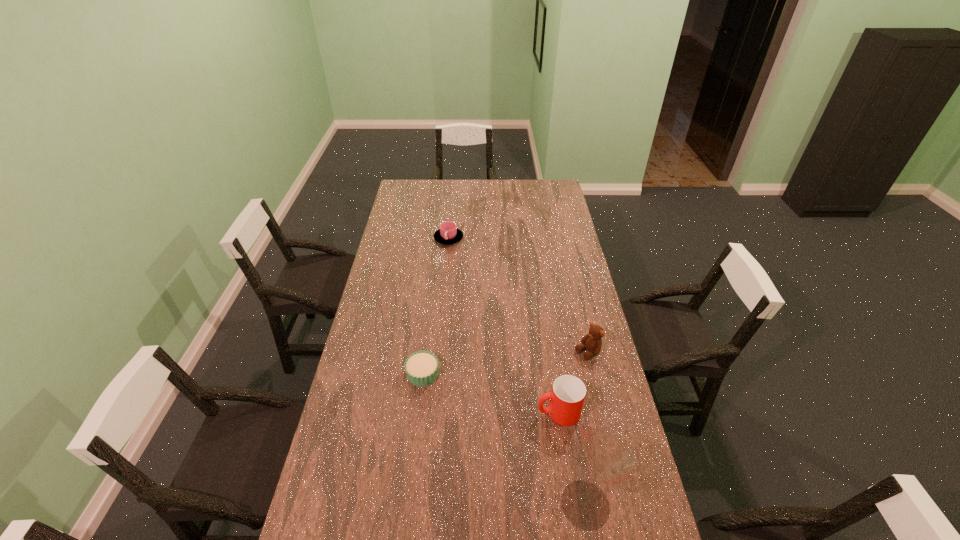
I want to click on flute glass situated at the right edge, so click(603, 460).

This screenshot has width=960, height=540. I want to click on teddy bear that is at the right edge, so click(592, 342).

Image resolution: width=960 pixels, height=540 pixels. In order to click on cup that is at the right edge in this screenshot , I will do `click(568, 392)`.

At what (x,y) coordinates should I click in order to perform the action: click on object at the near right corner. Please return your answer as a coordinate pair (x, y). This screenshot has width=960, height=540. Looking at the image, I should click on (603, 460).

The image size is (960, 540). I want to click on free space at the far edge of the desktop, so click(x=445, y=191).

The height and width of the screenshot is (540, 960). Identify the location of free space at the near edge of the desktop. (380, 532).

What are the coordinates of `vacant space at the left edge` in the screenshot? It's located at (360, 342).

The height and width of the screenshot is (540, 960). Identify the location of vacant space at the right edge. (553, 291).

This screenshot has width=960, height=540. What are the coordinates of `free space between the left cup and the teddy bear` in the screenshot? It's located at (518, 295).

The image size is (960, 540). I want to click on empty space that is in between the cupcake and the taller cup, so click(491, 394).